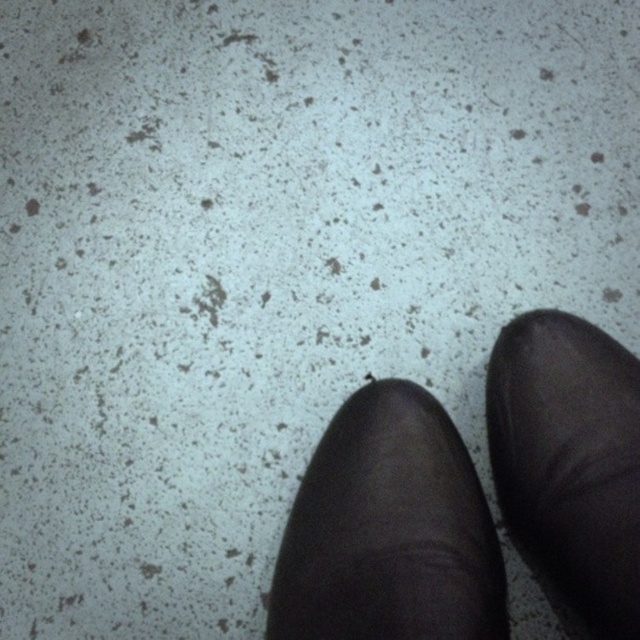
Question: Does black leather shoe at center appear under black leather shoe at lower right?

Choices:
 (A) yes
 (B) no

Answer: (A)

Question: Is black leather shoe at center to the right of black leather shoe at lower right from the viewer's perspective?

Choices:
 (A) yes
 (B) no

Answer: (B)

Question: Which point is farther to the camera?

Choices:
 (A) black leather shoe at lower right
 (B) black leather shoe at center

Answer: (A)

Question: Does black leather shoe at center have a smaller size compared to black leather shoe at lower right?

Choices:
 (A) no
 (B) yes

Answer: (A)

Question: Among these points, which one is farthest from the camera?

Choices:
 (A) (582, 508)
 (B) (369, 483)

Answer: (B)

Question: Among these objects, which one is nearest to the camera?

Choices:
 (A) black leather shoe at lower right
 (B) black leather shoe at center

Answer: (B)